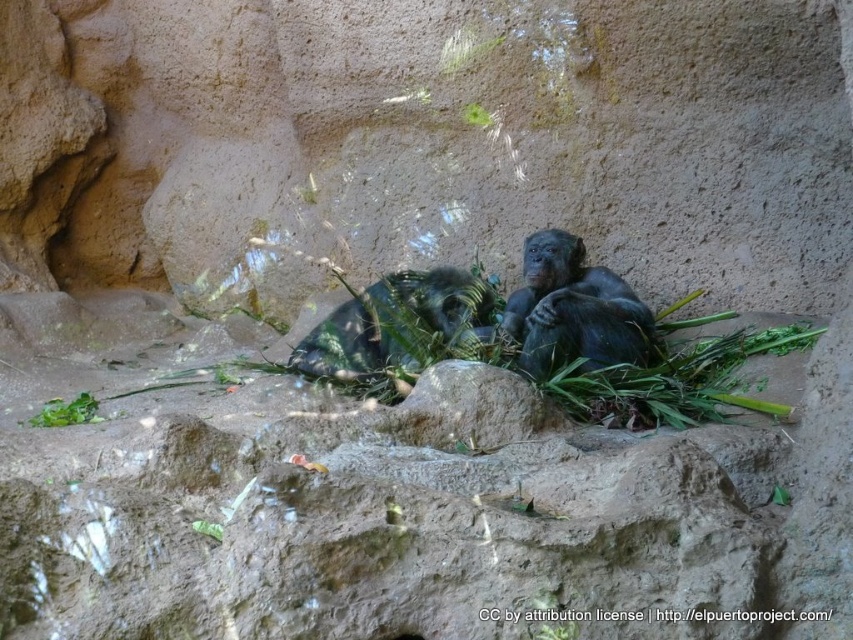
Which is below, shiny black ape at center or green leafy plant at lower center?

green leafy plant at lower center is lower down.

Is point (573, 323) in front of point (199, 529)?

No, (573, 323) is further to viewer.

Locate an element on the screen. shiny black ape at center is located at coordinates (573, 308).

Can you confirm if green leafy plant at center is positioned to the left of green leafy plant at lower center?

In fact, green leafy plant at center is to the right of green leafy plant at lower center.

Does green leafy plant at center have a greater height compared to green leafy plant at lower center?

Yes.

Is point (689, 387) farther from camera compared to point (222, 534)?

Yes, point (689, 387) is behind point (222, 534).

At what (x,y) coordinates should I click in order to perform the action: click on green leafy plant at center. Please return your answer as a coordinate pair (x, y). Looking at the image, I should click on (675, 378).

Which is more to the right, shiny black ape at center or green leafy plant at upper center?

Positioned to the right is shiny black ape at center.

Based on the photo, can you confirm if shiny black ape at center is positioned above green leafy plant at upper center?

Actually, shiny black ape at center is below green leafy plant at upper center.

Looking at this image, who is more forward, [561,323] or [485,115]?

Point [561,323] is more forward.

Where is `shiny black ape at center`? shiny black ape at center is located at coordinates (573, 308).